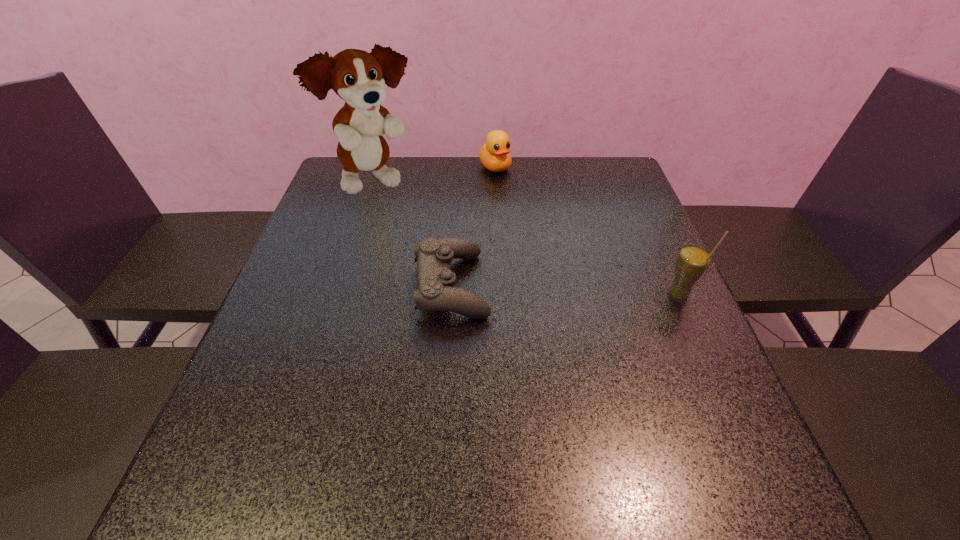
This screenshot has height=540, width=960. I want to click on control, so click(435, 292).

Locate an element on the screen. The image size is (960, 540). the third shortest object is located at coordinates (693, 260).

At what (x,y) coordinates should I click in order to perform the action: click on the rightmost object. Please return your answer as a coordinate pair (x, y). The height and width of the screenshot is (540, 960). Looking at the image, I should click on (693, 260).

Identify the location of duckling. (495, 155).

I want to click on puppy, so click(x=358, y=77).

In order to click on the leftmost object in this screenshot , I will do `click(358, 77)`.

At what (x,y) coordinates should I click in order to perform the action: click on vacant area situated 0.250m on the left of the shortest object. Please return your answer as a coordinate pair (x, y). The height and width of the screenshot is (540, 960). Looking at the image, I should click on (301, 286).

The width and height of the screenshot is (960, 540). In order to click on free region located on the left of the straw for drinking in this screenshot , I will do `click(546, 295)`.

Image resolution: width=960 pixels, height=540 pixels. In order to click on vacant region located 0.110m on the face of the duckling in this screenshot , I will do `click(516, 197)`.

I want to click on vacant space located 0.300m on the face of the duckling, so tap(547, 236).